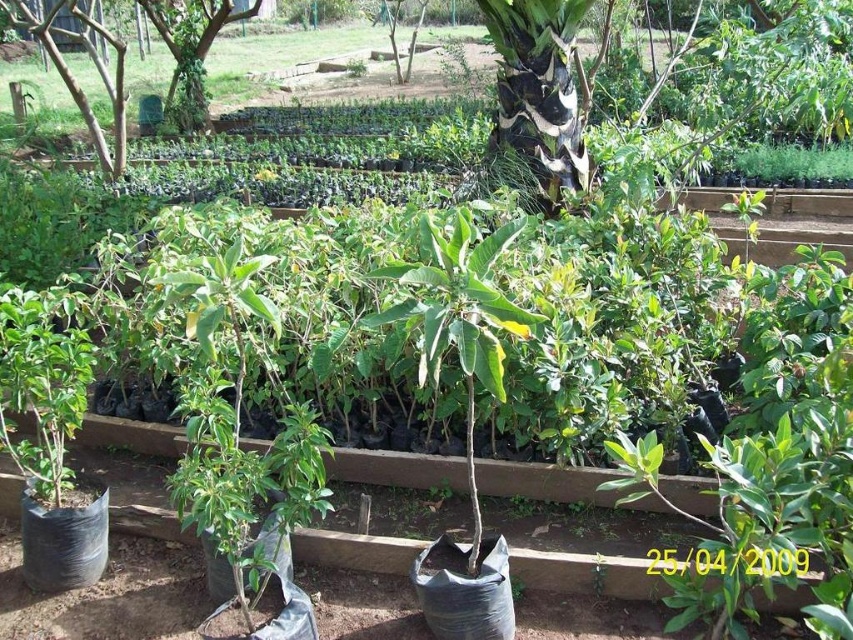
Question: From the image, what is the correct spatial relationship of black and white bark at center in relation to green leafy tree at upper left?

Choices:
 (A) below
 (B) above

Answer: (A)

Question: Among these points, which one is farthest from the camera?

Choices:
 (A) tap(207, 8)
 (B) tap(222, 4)

Answer: (A)

Question: Is black and white bark at center above green plastic tree at upper left?

Choices:
 (A) yes
 (B) no

Answer: (B)

Question: Which point is farther to the camera?

Choices:
 (A) (537, 176)
 (B) (201, 38)
 (C) (163, 28)

Answer: (C)

Question: Does black and white bark at center appear on the left side of green leafy tree at upper left?

Choices:
 (A) yes
 (B) no

Answer: (B)

Question: Estimate the real-world distances between objects in this image. Which object is closer to the green leafy tree at upper left?

Choices:
 (A) green plastic tree at upper left
 (B) black and white bark at center

Answer: (A)